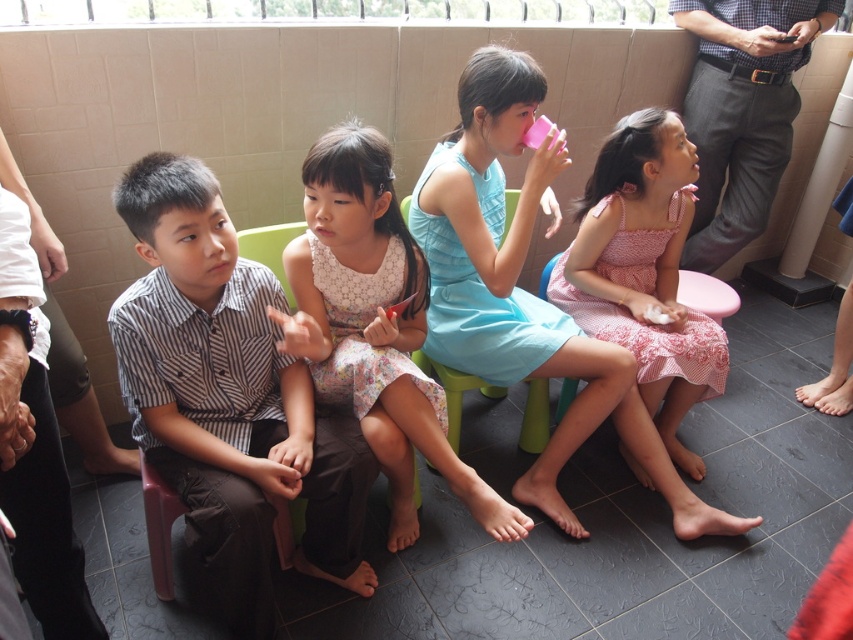
Question: Among these points, which one is nearest to the camera?

Choices:
 (A) (392, 452)
 (B) (312, 413)

Answer: (A)

Question: Estimate the real-world distances between objects in this image. Which object is closer to the striped cotton shirt at center?

Choices:
 (A) floral dress at center
 (B) pink cotton dress at center
 (C) light blue fabric dress at center
 (D) green plastic chair at center

Answer: (A)

Question: From the image, what is the correct spatial relationship of striped cotton shirt at center in relation to light blue fabric dress at center?

Choices:
 (A) below
 (B) above

Answer: (A)

Question: Does light blue fabric dress at center lie behind pink cotton dress at center?

Choices:
 (A) no
 (B) yes

Answer: (A)

Question: Is striped cotton shirt at center wider than green plastic chair at center?

Choices:
 (A) yes
 (B) no

Answer: (A)

Question: Considering the real-world distances, which object is farthest from the green plastic chair at center?

Choices:
 (A) pink cotton dress at center
 (B) striped cotton shirt at center
 (C) floral dress at center
 (D) light blue fabric dress at center

Answer: (B)